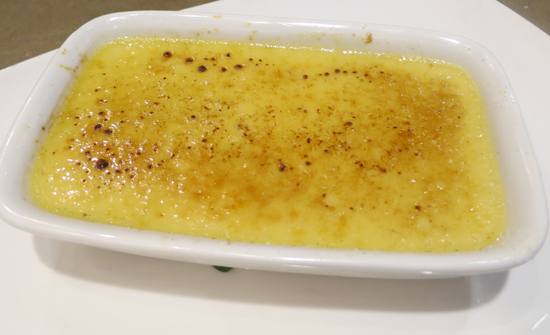
The image size is (550, 335). What are the coordinates of `white square bowl` in the screenshot? It's located at (235, 256).